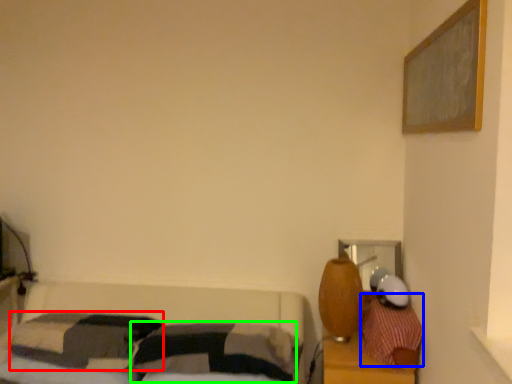
Question: Estimate the real-world distances between objects in this image. Which object is closer to pillow (highlighted by a red box), pillow (highlighted by a blue box) or pillow (highlighted by a green box)?

Choices:
 (A) pillow
 (B) pillow

Answer: (B)